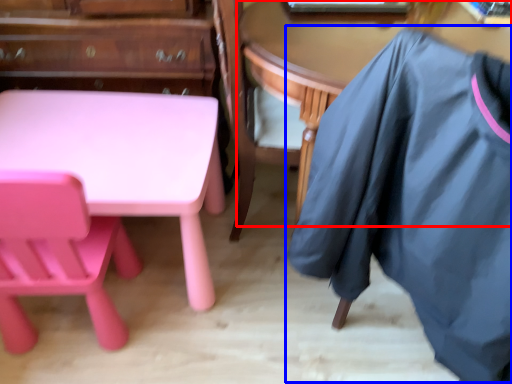
Question: Which object appears closest to the camera in this image, table (highlighted by a red box) or clothing (highlighted by a blue box)?

Choices:
 (A) table
 (B) clothing

Answer: (B)